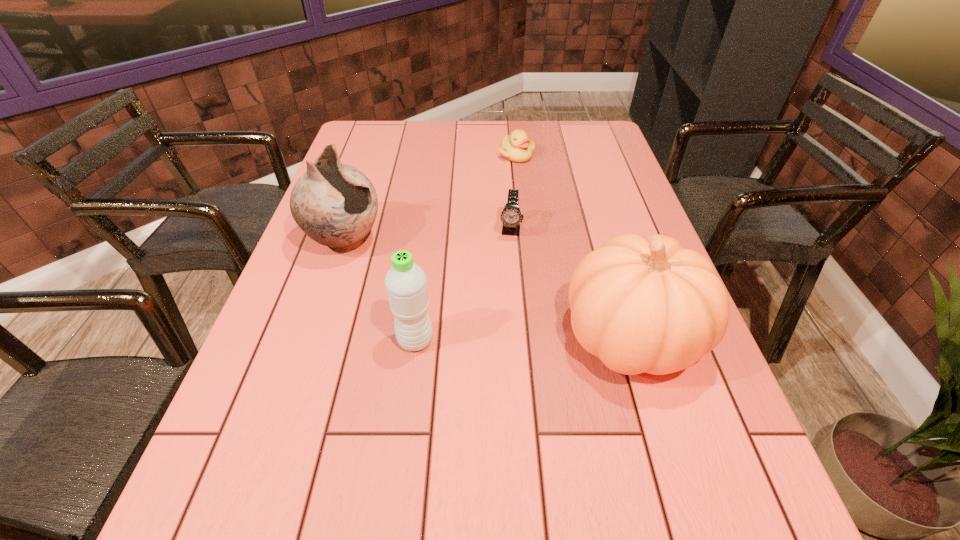
This screenshot has width=960, height=540. In order to click on free point between the leftmost object and the water bottle in this screenshot , I will do `click(380, 291)`.

You are a GUI agent. You are given a task and a screenshot of the screen. Output one action in this format:
    pyautogui.click(x=<x>, y=<y>)
    Task: Click on the free spot between the second object from left to right and the pumpkin
    This screenshot has width=960, height=540.
    Given the screenshot: What is the action you would take?
    pyautogui.click(x=523, y=338)

Identify the location of free spot between the leftmost object and the water bottle. (380, 291).

The width and height of the screenshot is (960, 540). Identify the location of free space between the pottery and the pumpkin. (488, 289).

Identify the location of free point between the farthest object and the second object from left to right. (466, 248).

Select which object is the fourth closest to the second shortest object. Please provide its 2D coordinates. Your answer should be formatted as a tuple, i.e. [(x, y)], where the tuple contains the x and y coordinates of a point satisfying the conditions above.

[(405, 282)]

Where is `the second closest object to the water bottle`? The height and width of the screenshot is (540, 960). the second closest object to the water bottle is located at coordinates (640, 304).

Find the location of `vacant area that satisfies the following two spatial constraints: 1. on the back side of the pottery; 2. on the left side of the watch`. vacant area that satisfies the following two spatial constraints: 1. on the back side of the pottery; 2. on the left side of the watch is located at coordinates (349, 230).

Locate an element on the screen. The width and height of the screenshot is (960, 540). free location that satisfies the following two spatial constraints: 1. on the front side of the leftmost object; 2. on the right side of the pumpkin is located at coordinates (314, 336).

Where is `free space that satisfies the following two spatial constraints: 1. on the front side of the leftmost object; 2. on the left side of the water bottle`? The height and width of the screenshot is (540, 960). free space that satisfies the following two spatial constraints: 1. on the front side of the leftmost object; 2. on the left side of the water bottle is located at coordinates (313, 340).